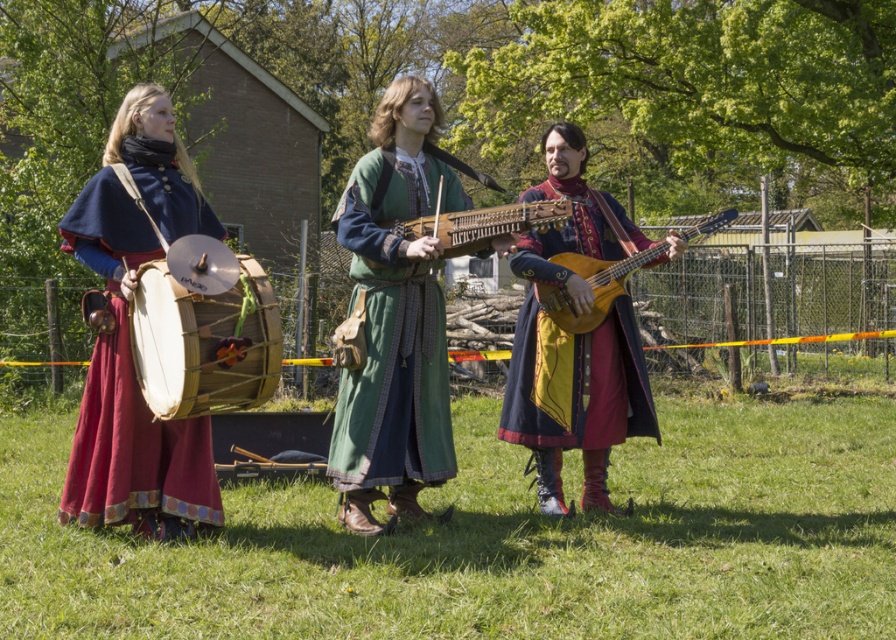
Question: Which of these objects is positioned closest to the velvet blue cape at left?

Choices:
 (A) natural wood drum at left
 (B) wooden stringed instrument at center

Answer: (A)

Question: Does velvet blue coat at center appear on the right side of natural wood drum at left?

Choices:
 (A) yes
 (B) no

Answer: (A)

Question: Among these points, which one is nearest to the camera?

Choices:
 (A) (522, 266)
 (B) (567, 308)
 (C) (114, 401)

Answer: (C)

Question: Which object is positioned closest to the wooden stringed instrument at center?

Choices:
 (A) velvet blue cape at left
 (B) green woolen tunic at center

Answer: (B)

Question: In this image, where is wooden stringed instrument at center located relative to wooden acoustic guitar at center?

Choices:
 (A) below
 (B) above

Answer: (B)

Question: Does green woolen tunic at center have a larger size compared to velvet blue coat at center?

Choices:
 (A) yes
 (B) no

Answer: (B)